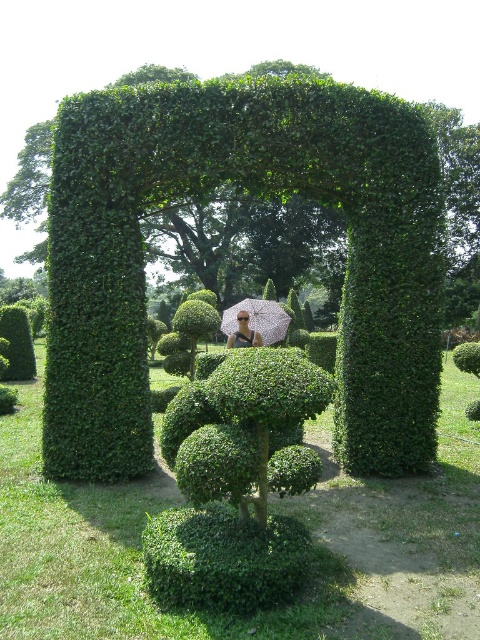
You are planning to host a garden party and need to choose an umbrella for shade. Given the pink fabric umbrella at center and the matte black umbrella at center in the garden scene, which one would provide more shade coverage?

The pink fabric umbrella at center is larger in size than the matte black umbrella at center, so it would provide more shade coverage.

Based on the photo, you are standing in the garden and want to take a photo of both the point at position (x=33, y=348) and the point at position (x=249, y=314). Which point will appear closer to the camera in the photo?

Point (x=33, y=348) is further to the camera than point (x=249, y=314), so the point at position (x=249, y=314) will appear closer to the camera in the photo.

In the scene shown: You are a photographer positioned at the garden entrance and want to capture both the pink fabric umbrella at center and the matte black umbrella at center in a single shot. Which umbrella will appear closer to the camera in the photo?

The pink fabric umbrella at center will appear closer to the camera because it is positioned further to the viewer than the matte black umbrella at center, making it nearer in the photograph.